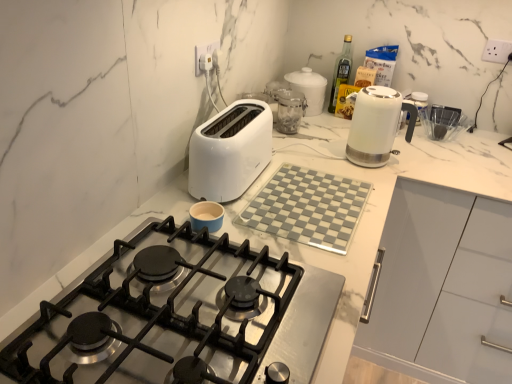
Question: Does stainless steel gas stove at center have a greater width compared to white glossy jar at upper center, marked as the 1th kitchen appliance in a back-to-front arrangement?

Choices:
 (A) yes
 (B) no

Answer: (A)

Question: Is white glossy jar at upper center, placed as the 3th kitchen appliance when sorted from front to back, a part of stainless steel gas stove at center?

Choices:
 (A) yes
 (B) no

Answer: (B)

Question: From a real-world perspective, is stainless steel gas stove at center located higher than white glossy jar at upper center, marked as the 1th kitchen appliance in a back-to-front arrangement?

Choices:
 (A) yes
 (B) no

Answer: (B)

Question: Does stainless steel gas stove at center turn towards white glossy jar at upper center, placed as the 3th kitchen appliance when sorted from front to back?

Choices:
 (A) yes
 (B) no

Answer: (B)

Question: Is stainless steel gas stove at center to the left of white glossy jar at upper center, marked as the 1th kitchen appliance in a back-to-front arrangement, from the viewer's perspective?

Choices:
 (A) no
 (B) yes

Answer: (B)

Question: From the image's perspective, is white plastic toaster at center above or below white glossy jar at upper center, marked as the 1th kitchen appliance in a back-to-front arrangement?

Choices:
 (A) below
 (B) above

Answer: (A)

Question: Is white plastic toaster at center taller or shorter than white glossy jar at upper center, marked as the 1th kitchen appliance in a back-to-front arrangement?

Choices:
 (A) short
 (B) tall

Answer: (B)

Question: Is point (224, 132) closer or farther from the camera than point (291, 77)?

Choices:
 (A) closer
 (B) farther

Answer: (A)

Question: Is white plastic toaster at center bigger or smaller than white glossy jar at upper center, marked as the 1th kitchen appliance in a back-to-front arrangement?

Choices:
 (A) big
 (B) small

Answer: (A)

Question: From a real-world perspective, is white plastic toaster at center above or below white glossy electric kettle at upper right, which is counted as the first kitchen appliance, starting from the front?

Choices:
 (A) below
 (B) above

Answer: (A)

Question: Is point (192, 140) closer or farther from the camera than point (348, 147)?

Choices:
 (A) farther
 (B) closer

Answer: (B)

Question: Considering the positions of white plastic toaster at center and white glossy electric kettle at upper right, the third kitchen appliance from the back, in the image, is white plastic toaster at center wider or thinner than white glossy electric kettle at upper right, the third kitchen appliance from the back,?

Choices:
 (A) wide
 (B) thin

Answer: (B)

Question: Is white plastic toaster at center bigger or smaller than white glossy electric kettle at upper right, which is counted as the first kitchen appliance, starting from the front?

Choices:
 (A) big
 (B) small

Answer: (A)

Question: Is clear glass bottle at upper right wider or thinner than white glossy jar at upper center, marked as the 1th kitchen appliance in a back-to-front arrangement?

Choices:
 (A) thin
 (B) wide

Answer: (A)

Question: Relative to white glossy jar at upper center, placed as the 3th kitchen appliance when sorted from front to back, is clear glass bottle at upper right in front or behind?

Choices:
 (A) behind
 (B) front

Answer: (A)